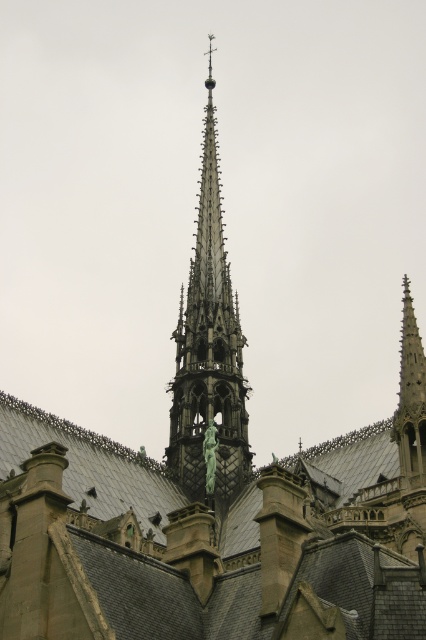
Question: From the image, what is the correct spatial relationship of dark gray stone spire at center in relation to green marble statue at upper center?

Choices:
 (A) left
 (B) right

Answer: (A)

Question: Which point is farther to the camera?

Choices:
 (A) (215, 449)
 (B) (230, 476)

Answer: (B)

Question: Among these objects, which one is nearest to the camera?

Choices:
 (A) dark gray stone spire at center
 (B) green marble statue at upper center

Answer: (B)

Question: Which object is closer to the camera taking this photo?

Choices:
 (A) green marble statue at upper center
 (B) dark gray stone spire at center

Answer: (A)

Question: Is dark gray stone spire at center closer to the viewer compared to green marble statue at upper center?

Choices:
 (A) no
 (B) yes

Answer: (A)

Question: Can you confirm if dark gray stone spire at center is positioned above green marble statue at upper center?

Choices:
 (A) no
 (B) yes

Answer: (B)